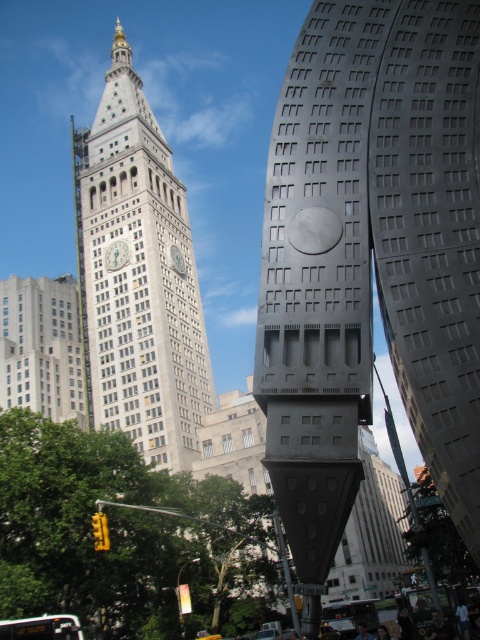
Between white stone clock tower at center and silver metallic clock at upper center, which one appears on the right side from the viewer's perspective?

From the viewer's perspective, silver metallic clock at upper center appears more on the right side.

Does point (157, 136) come in front of point (106, 248)?

No.

Does point (154, 182) come farther from viewer compared to point (128, 248)?

Yes, point (154, 182) is farther from viewer.

This screenshot has height=640, width=480. Find the location of `white stone clock tower at center`. white stone clock tower at center is located at coordinates (137, 278).

Who is positioned more to the right, white stone clock tower at center or silver metallic clock at center?

silver metallic clock at center

Does point (155, 230) come in front of point (184, 273)?

Yes.

Identify the location of white stone clock tower at center. The image size is (480, 640). (137, 278).

Where is `white stone clock tower at center`? Image resolution: width=480 pixels, height=640 pixels. white stone clock tower at center is located at coordinates (137, 278).

Is silver metallic clock at upper center shorter than silver metallic clock at center?

Indeed, silver metallic clock at upper center has a lesser height compared to silver metallic clock at center.

Which is above, silver metallic clock at upper center or silver metallic clock at center?

silver metallic clock at upper center

Who is more distant from viewer, (116, 248) or (177, 252)?

The point (177, 252) is more distant.

Where is `silver metallic clock at upper center`? This screenshot has width=480, height=640. silver metallic clock at upper center is located at coordinates (116, 256).